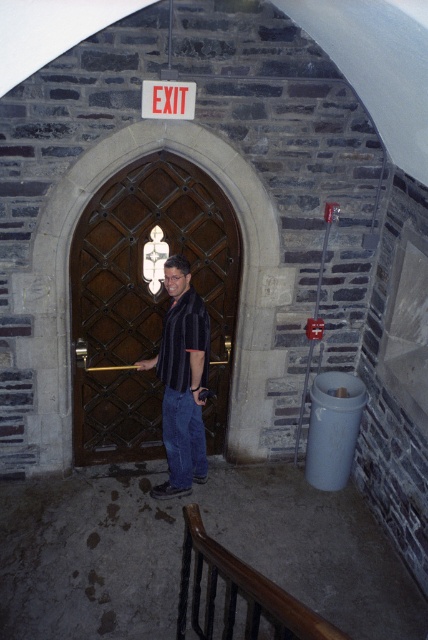
Looking at this image, you are a fashion designer observing a man in a stone building. He is wearing two shirts. The striped cotton shirt at center and the black striped shirt at center. Which one has a bigger size?

The striped cotton shirt at center is larger in size than the black striped shirt at center.

You are an interior designer assessing the layout of this space. You need to determine if the striped cotton shirt at center is closer to the viewer than the brown polished wood handrail at upper center. Based on the scene, what is your conclusion?

The striped cotton shirt at center is further to the viewer than brown polished wood handrail at upper center.